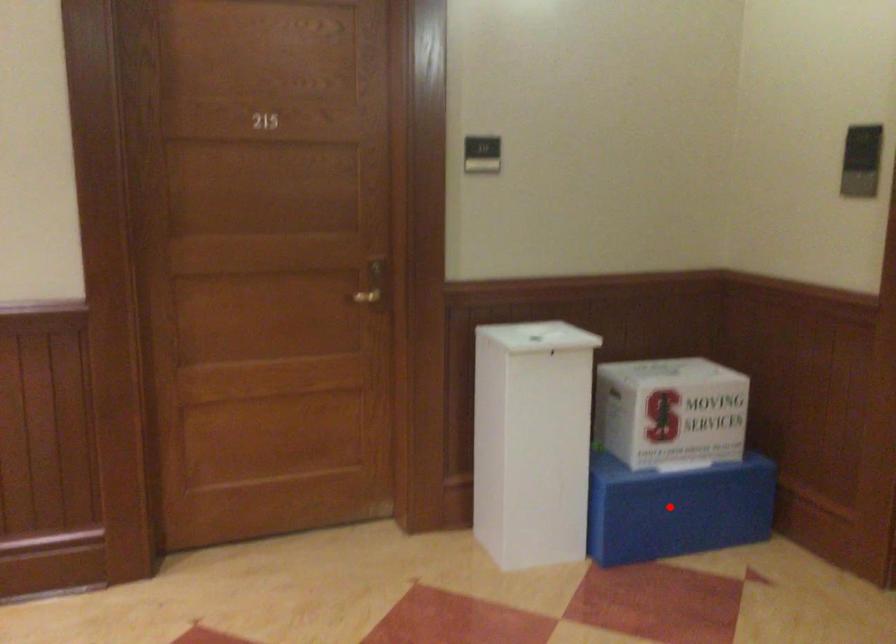
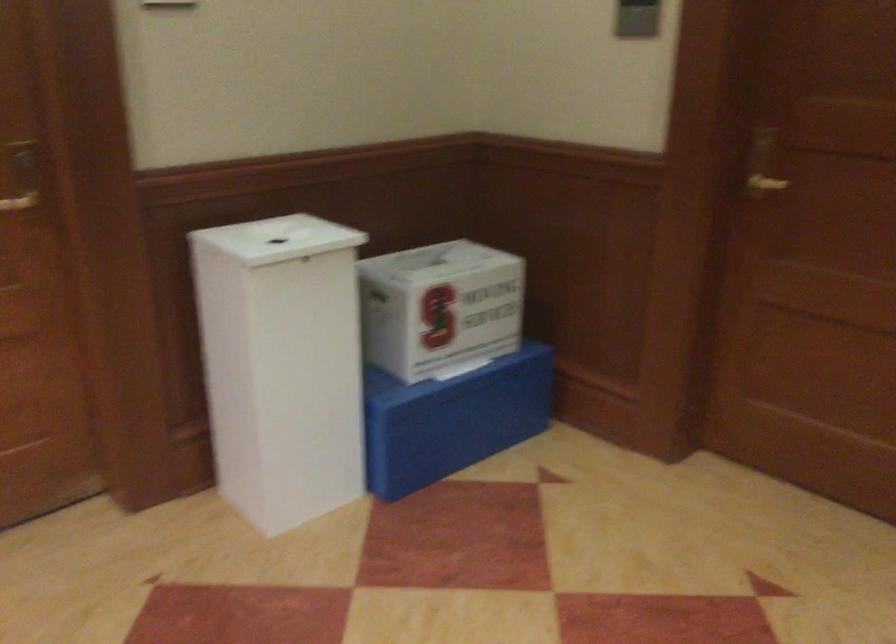
Question: A red point is marked in image1. In image2, is the corresponding 3D point closer to the camera or farther? Reply with the corresponding letter.

Choices:
 (A) The corresponding 3D point is closer.
 (B) The corresponding 3D point is farther.

Answer: (A)